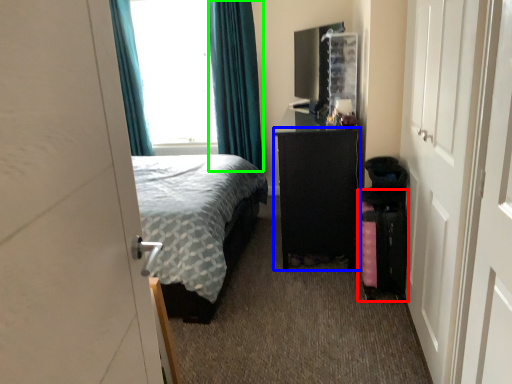
Question: Which object is positioned farthest from luggage (highlighted by a red box)? Select from furniture (highlighted by a blue box) and curtain (highlighted by a green box).

Choices:
 (A) furniture
 (B) curtain

Answer: (B)